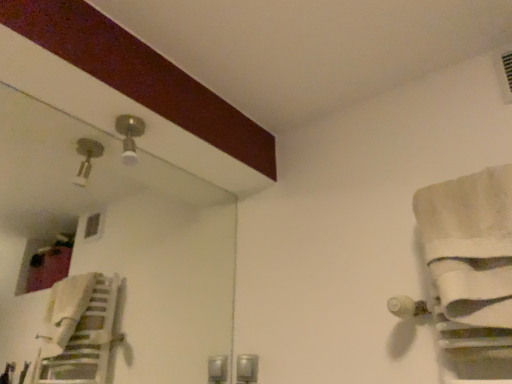
Describe the element at coordinates (129, 135) in the screenshot. I see `matte silver light fixture at upper center` at that location.

In order to face matte silver light fixture at upper center, should I rotate leftwards or rightwards?

To align with it, rotate left about 16.356°.

This screenshot has width=512, height=384. I want to click on matte silver light fixture at upper center, so click(x=129, y=135).

The width and height of the screenshot is (512, 384). What do you see at coordinates (470, 245) in the screenshot?
I see `white cotton bath towel at right` at bounding box center [470, 245].

Find the location of `white cotton bath towel at right`. white cotton bath towel at right is located at coordinates (470, 245).

Identify the location of matte silver light fixture at upper center. (129, 135).

Between matte silver light fixture at upper center and white cotton bath towel at right, which one appears on the left side from the viewer's perspective?

matte silver light fixture at upper center is more to the left.

Is matte silver light fixture at upper center positioned before white cotton bath towel at right?

No, matte silver light fixture at upper center is further to the viewer.

Does point (141, 133) come closer to viewer compared to point (503, 292)?

No.

From the image's perspective, is matte silver light fixture at upper center positioned above or below white cotton bath towel at right?

matte silver light fixture at upper center is above white cotton bath towel at right.

From a real-world perspective, relative to white cotton bath towel at right, is matte silver light fixture at upper center vertically above or below?

In terms of real-world spatial position, matte silver light fixture at upper center is above white cotton bath towel at right.

In terms of width, does matte silver light fixture at upper center look wider or thinner when compared to white cotton bath towel at right?

In the image, matte silver light fixture at upper center appears to be more narrow than white cotton bath towel at right.

Does matte silver light fixture at upper center have a greater height compared to white cotton bath towel at right?

In fact, matte silver light fixture at upper center may be shorter than white cotton bath towel at right.

In terms of size, does matte silver light fixture at upper center appear bigger or smaller than white cotton bath towel at right?

In the image, matte silver light fixture at upper center appears to be smaller than white cotton bath towel at right.

Is matte silver light fixture at upper center not within white cotton bath towel at right?

Yes.

In the scene shown: Is matte silver light fixture at upper center with white cotton bath towel at right?

No, matte silver light fixture at upper center is not in contact with white cotton bath towel at right.

Is matte silver light fixture at upper center oriented towards white cotton bath towel at right?

No, matte silver light fixture at upper center is not turned towards white cotton bath towel at right.

How different are the orientations of matte silver light fixture at upper center and white cotton bath towel at right in degrees?

matte silver light fixture at upper center and white cotton bath towel at right are facing 89.1 degrees away from each other.

Where is `light fixture above the white cotton bath towel at right (from the image's perspective)`? This screenshot has width=512, height=384. light fixture above the white cotton bath towel at right (from the image's perspective) is located at coordinates (129, 135).

Which object is positioned more to the right, white cotton bath towel at right or matte silver light fixture at upper center?

white cotton bath towel at right is more to the right.

Which object is further away from the camera, white cotton bath towel at right or matte silver light fixture at upper center?

matte silver light fixture at upper center is more distant.

Does point (493, 208) come in front of point (128, 150)?

Yes.

Looking at this image, from the image's perspective, does white cotton bath towel at right appear lower than matte silver light fixture at upper center?

Yes.

From a real-world perspective, is white cotton bath towel at right physically below matte silver light fixture at upper center?

Yes.

From the picture: Can you confirm if white cotton bath towel at right is wider than matte silver light fixture at upper center?

Indeed, white cotton bath towel at right has a greater width compared to matte silver light fixture at upper center.

Considering the sizes of objects white cotton bath towel at right and matte silver light fixture at upper center in the image provided, who is taller, white cotton bath towel at right or matte silver light fixture at upper center?

white cotton bath towel at right is taller.

Is white cotton bath towel at right smaller than matte silver light fixture at upper center?

Actually, white cotton bath towel at right might be larger than matte silver light fixture at upper center.

Is white cotton bath towel at right located outside matte silver light fixture at upper center?

white cotton bath towel at right is positioned outside matte silver light fixture at upper center.

Is white cotton bath towel at right beside matte silver light fixture at upper center?

No, white cotton bath towel at right is not with matte silver light fixture at upper center.

Is white cotton bath towel at right facing towards matte silver light fixture at upper center?

No, white cotton bath towel at right is not facing towards matte silver light fixture at upper center.

At what (x,y) coordinates should I click in order to perform the action: click on light fixture that appears above the white cotton bath towel at right (from the image's perspective). Please return your answer as a coordinate pair (x, y). The height and width of the screenshot is (384, 512). Looking at the image, I should click on (129, 135).

Where is `bath towel below the matte silver light fixture at upper center (from the image's perspective)`? bath towel below the matte silver light fixture at upper center (from the image's perspective) is located at coordinates (470, 245).

The width and height of the screenshot is (512, 384). Find the location of `light fixture that appears above the white cotton bath towel at right (from the image's perspective)`. light fixture that appears above the white cotton bath towel at right (from the image's perspective) is located at coordinates (129, 135).